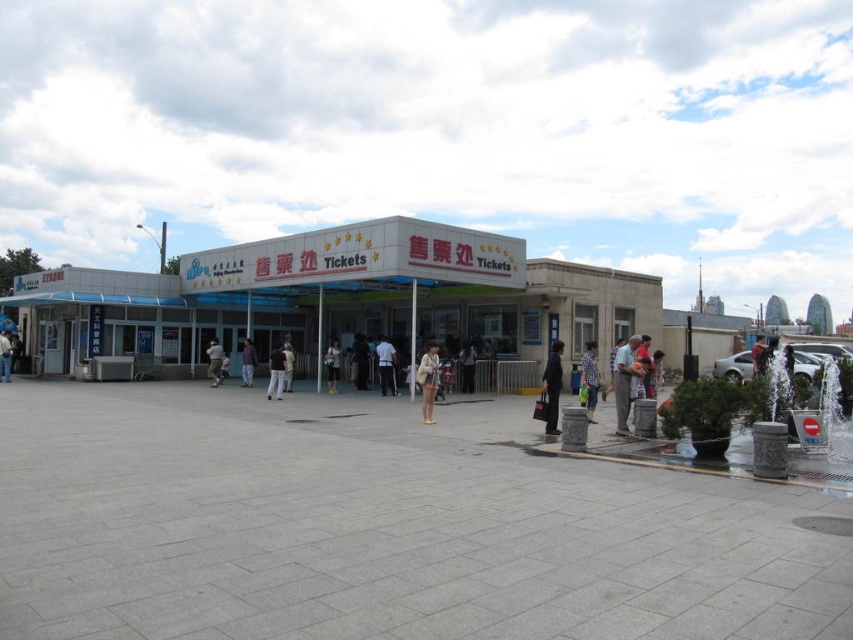
You are standing in front of the ticket booth and see the gray concrete plaza at center and the light brown leather jacket at center. Which object is taller?

The light brown leather jacket at center is taller than the gray concrete plaza at center.

You are standing in front of the ticket booth and see the gray concrete plaza at center and the light brown leather jacket at center. Which object is larger in size?

The gray concrete plaza at center is bigger than the light brown leather jacket at center.